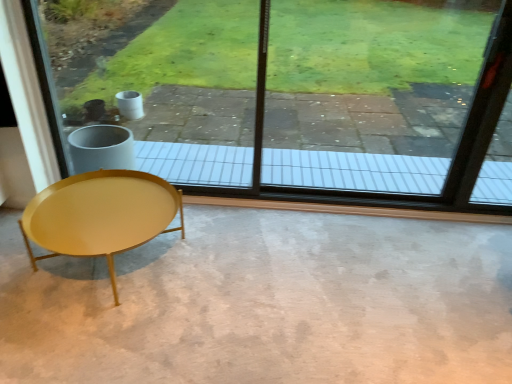
You are a GUI agent. You are given a task and a screenshot of the screen. Output one action in this format:
    pyautogui.click(x=<x>, y=<y>)
    Task: Click on the free space to the right of shiny gold coffee table at lower left
    This screenshot has height=384, width=512.
    Given the screenshot: What is the action you would take?
    pyautogui.click(x=239, y=272)